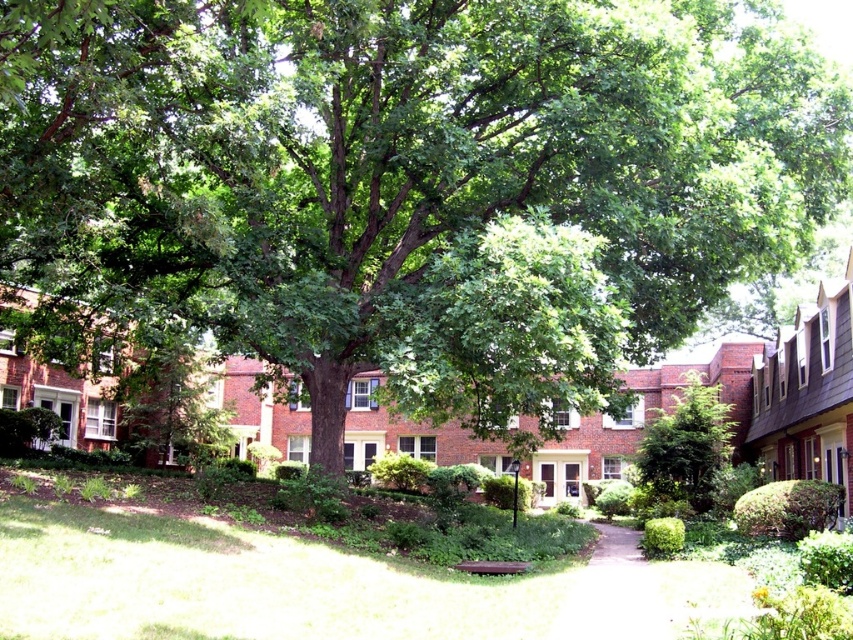
Question: Which of the following is the farthest from the observer?

Choices:
 (A) (656, 474)
 (B) (607, 614)

Answer: (A)

Question: Can you confirm if green leafy tree at center is thinner than white gravel path at center?

Choices:
 (A) no
 (B) yes

Answer: (A)

Question: Can you confirm if green leafy tree at center is bigger than white gravel path at center?

Choices:
 (A) yes
 (B) no

Answer: (A)

Question: Which point is closer to the camera taking this photo?

Choices:
 (A) (728, 433)
 (B) (654, 589)

Answer: (B)

Question: Does green leafy tree at center come behind white gravel path at center?

Choices:
 (A) yes
 (B) no

Answer: (A)